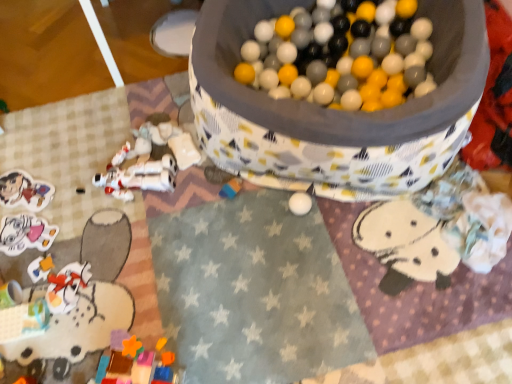
Identify the location of free space between plastic toy figure at lower left, placed as the fourth toy when sorted from right to left, and white plastic astronaut at lower left, placed as the 3th toy when sorted from right to left. This screenshot has height=384, width=512. (101, 232).